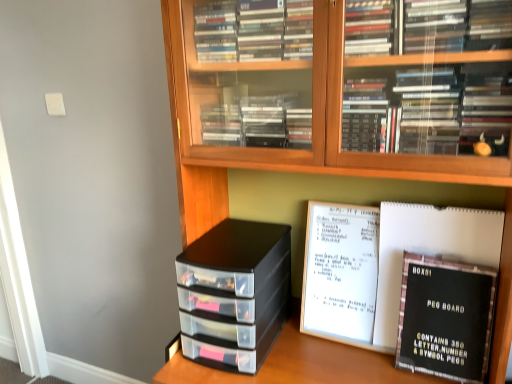
Question: In terms of width, does black matte peg board at center right look wider or thinner when compared to black cardboard peg board at lower right?

Choices:
 (A) thin
 (B) wide

Answer: (B)

Question: In the image, is black matte peg board at center right positioned in front of or behind black cardboard peg board at lower right?

Choices:
 (A) behind
 (B) front

Answer: (A)

Question: Which of these objects is positioned closest to the black cardboard peg board at lower right?

Choices:
 (A) black plastic storage drawers at center
 (B) black matte peg board at center right
 (C) wooden bookcase at center

Answer: (B)

Question: Estimate the real-world distances between objects in this image. Which object is farther from the black matte peg board at center right?

Choices:
 (A) wooden bookcase at center
 (B) black plastic storage drawers at center
 (C) black cardboard peg board at lower right

Answer: (B)